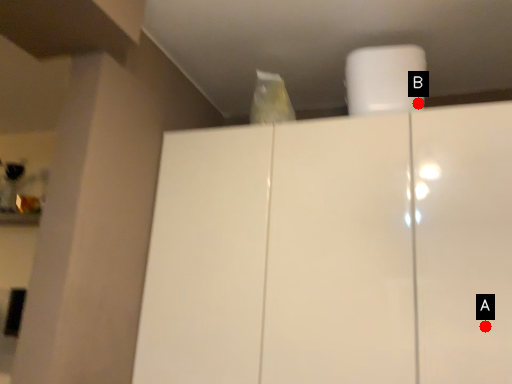
Question: Two points are circled on the image, labeled by A and B beside each circle. Which point appears closest to the camera in this image?

Choices:
 (A) A is closer
 (B) B is closer

Answer: (A)